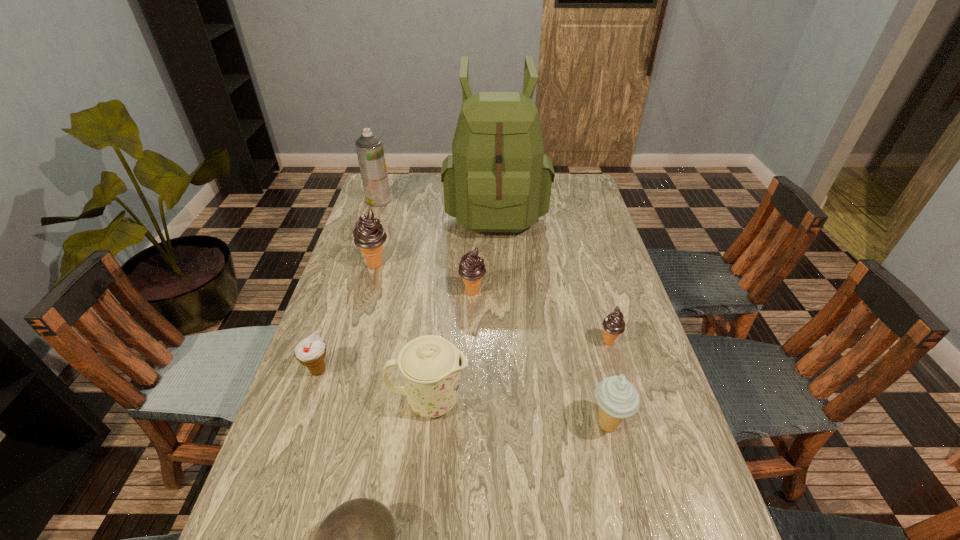
Locate an element on the screen. The image size is (960, 540). backpack at the far edge is located at coordinates tap(497, 180).

Where is `aerosol can situated at the far edge`? Image resolution: width=960 pixels, height=540 pixels. aerosol can situated at the far edge is located at coordinates (369, 147).

Identify the location of aerosol can present at the left edge. (369, 147).

Where is `object positioned at the far left corner`? object positioned at the far left corner is located at coordinates (369, 147).

Image resolution: width=960 pixels, height=540 pixels. Find the location of `free spot at the left edge of the desktop`. free spot at the left edge of the desktop is located at coordinates (284, 534).

The height and width of the screenshot is (540, 960). I want to click on vacant space at the right edge, so click(x=667, y=509).

Where is `blank space at the far right corner`? blank space at the far right corner is located at coordinates (570, 177).

Locate an element on the screen. vacant area between the backpack and the third icecream from right to left is located at coordinates (484, 250).

Find the location of a particular element. Image resolution: width=960 pixels, height=540 pixels. free space between the third farthest object and the second nearest icecream is located at coordinates (347, 318).

Identify the location of vacant space that's between the beige icecream and the second chocolate icecream from left to right. (540, 359).